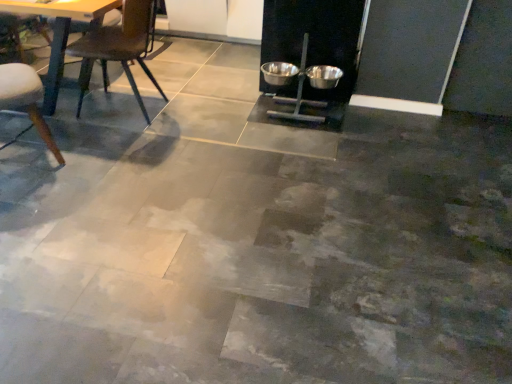
Where is `metallic silver bowl at center-right, the 2th bowl viewed from the left`? The height and width of the screenshot is (384, 512). metallic silver bowl at center-right, the 2th bowl viewed from the left is located at coordinates (324, 76).

You are a GUI agent. You are given a task and a screenshot of the screen. Output one action in this format:
    pyautogui.click(x=<x>, y=<y>)
    Task: Click on the wooden chair at left, the second chair when ordered from right to left
    
    Given the screenshot: What is the action you would take?
    pyautogui.click(x=26, y=99)

This screenshot has height=384, width=512. Describe the element at coordinates (279, 73) in the screenshot. I see `metallic bowls at center, the second bowl in the right-to-left sequence` at that location.

I want to click on metallic dark brown chair at left, the first chair positioned from the right, so click(119, 48).

Is metallic dark brown chair at left, the first chair positioned from the right, oriented towards wooden chair at left, the first chair positioned from the left?

No.

Is there a large distance between metallic dark brown chair at left, positioned as the 2th chair in left-to-right order, and wooden chair at left, the first chair positioned from the left?

No, metallic dark brown chair at left, positioned as the 2th chair in left-to-right order, is not far away from wooden chair at left, the first chair positioned from the left.

Which object is closer to the camera, metallic dark brown chair at left, the first chair positioned from the right, or wooden chair at left, the second chair when ordered from right to left?

wooden chair at left, the second chair when ordered from right to left.

Is metallic bowls at center, the second bowl in the right-to-left sequence, inside the boundaries of wooden chair at left, the second chair when ordered from right to left, or outside?

metallic bowls at center, the second bowl in the right-to-left sequence, is not inside wooden chair at left, the second chair when ordered from right to left, it's outside.

Is metallic bowls at center, the second bowl in the right-to-left sequence, bigger or smaller than wooden chair at left, the second chair when ordered from right to left?

In the image, metallic bowls at center, the second bowl in the right-to-left sequence, appears to be smaller than wooden chair at left, the second chair when ordered from right to left.

Considering the relative positions of metallic bowls at center, placed as the first bowl when sorted from left to right, and wooden chair at left, the second chair when ordered from right to left, in the image provided, is metallic bowls at center, placed as the first bowl when sorted from left to right, behind wooden chair at left, the second chair when ordered from right to left,?

Yes, the depth of metallic bowls at center, placed as the first bowl when sorted from left to right, is greater than that of wooden chair at left, the second chair when ordered from right to left.

The width and height of the screenshot is (512, 384). What are the coordinates of `the 2nd bowl behind when counting from the wooden chair at left, the first chair positioned from the left` in the screenshot? It's located at (279, 73).

Based on the photo, from the image's perspective, is wooden chair at left, the second chair when ordered from right to left, located above or below metallic dark brown chair at left, positioned as the 2th chair in left-to-right order?

Based on their image positions, wooden chair at left, the second chair when ordered from right to left, is located beneath metallic dark brown chair at left, positioned as the 2th chair in left-to-right order.

Is wooden chair at left, the second chair when ordered from right to left, wider than metallic dark brown chair at left, positioned as the 2th chair in left-to-right order?

Incorrect, the width of wooden chair at left, the second chair when ordered from right to left, does not surpass that of metallic dark brown chair at left, positioned as the 2th chair in left-to-right order.

Is metallic dark brown chair at left, positioned as the 2th chair in left-to-right order, at the back of wooden chair at left, the second chair when ordered from right to left?

wooden chair at left, the second chair when ordered from right to left, is not turned away from metallic dark brown chair at left, positioned as the 2th chair in left-to-right order.

In terms of size, does wooden chair at left, the second chair when ordered from right to left, appear bigger or smaller than metallic dark brown chair at left, positioned as the 2th chair in left-to-right order?

Considering their sizes, wooden chair at left, the second chair when ordered from right to left, takes up less space than metallic dark brown chair at left, positioned as the 2th chair in left-to-right order.

Would you say wooden chair at left, the second chair when ordered from right to left, contains metallic silver bowl at center-right, the 1th bowl from the right?

A: Definitely not — metallic silver bowl at center-right, the 1th bowl from the right, is not inside wooden chair at left, the second chair when ordered from right to left.

Are wooden chair at left, the second chair when ordered from right to left, and metallic silver bowl at center-right, the 2th bowl viewed from the left, located far from each other?

Yes.

Does wooden chair at left, the second chair when ordered from right to left, have a larger size compared to metallic silver bowl at center-right, the 1th bowl from the right?

Yes, wooden chair at left, the second chair when ordered from right to left, is bigger than metallic silver bowl at center-right, the 1th bowl from the right.

How many degrees apart are the facing directions of wooden chair at left, the second chair when ordered from right to left, and metallic silver bowl at center-right, the 1th bowl from the right?

135 degrees.

Could you tell me if metallic bowls at center, the second bowl in the right-to-left sequence, is turned towards metallic silver bowl at center-right, the 2th bowl viewed from the left?

No, metallic bowls at center, the second bowl in the right-to-left sequence, is not facing towards metallic silver bowl at center-right, the 2th bowl viewed from the left.

Where is `bowl behind the metallic silver bowl at center-right, the 2th bowl viewed from the left`? bowl behind the metallic silver bowl at center-right, the 2th bowl viewed from the left is located at coordinates (279, 73).

Is metallic bowls at center, placed as the first bowl when sorted from left to right, closer to camera compared to metallic silver bowl at center-right, the 1th bowl from the right?

That is False.

What's the angular difference between metallic bowls at center, the second bowl in the right-to-left sequence, and metallic silver bowl at center-right, the 1th bowl from the right,'s facing directions?

0.000851 degrees separate the facing orientations of metallic bowls at center, the second bowl in the right-to-left sequence, and metallic silver bowl at center-right, the 1th bowl from the right.

From the image's perspective, is metallic silver bowl at center-right, the 2th bowl viewed from the left, on top of metallic bowls at center, placed as the first bowl when sorted from left to right?

No, from the image's perspective, metallic silver bowl at center-right, the 2th bowl viewed from the left, is not above metallic bowls at center, placed as the first bowl when sorted from left to right.

Which of these two, metallic silver bowl at center-right, the 2th bowl viewed from the left, or metallic bowls at center, the second bowl in the right-to-left sequence, is thinner?

Thinner between the two is metallic silver bowl at center-right, the 2th bowl viewed from the left.

Considering the relative positions of metallic silver bowl at center-right, the 2th bowl viewed from the left, and metallic bowls at center, the second bowl in the right-to-left sequence, in the image provided, is metallic silver bowl at center-right, the 2th bowl viewed from the left, to the right of metallic bowls at center, the second bowl in the right-to-left sequence, from the viewer's perspective?

Yes.

Is metallic silver bowl at center-right, the 1th bowl from the right, in front of or behind metallic bowls at center, placed as the first bowl when sorted from left to right, in the image?

Clearly, metallic silver bowl at center-right, the 1th bowl from the right, is in front of metallic bowls at center, placed as the first bowl when sorted from left to right.

Which of these two, metallic silver bowl at center-right, the 1th bowl from the right, or metallic dark brown chair at left, the first chair positioned from the right, is smaller?

metallic silver bowl at center-right, the 1th bowl from the right.

Between metallic silver bowl at center-right, the 2th bowl viewed from the left, and metallic dark brown chair at left, positioned as the 2th chair in left-to-right order, which one appears on the left side from the viewer's perspective?

metallic dark brown chair at left, positioned as the 2th chair in left-to-right order.

Is metallic silver bowl at center-right, the 1th bowl from the right, in front of metallic dark brown chair at left, positioned as the 2th chair in left-to-right order?

No, metallic silver bowl at center-right, the 1th bowl from the right, is further to the viewer.

Based on the photo, would you say metallic silver bowl at center-right, the 2th bowl viewed from the left, is a long distance from metallic dark brown chair at left, positioned as the 2th chair in left-to-right order?

metallic silver bowl at center-right, the 2th bowl viewed from the left, is positioned a significant distance from metallic dark brown chair at left, positioned as the 2th chair in left-to-right order.

Image resolution: width=512 pixels, height=384 pixels. I want to click on chair behind the wooden chair at left, the second chair when ordered from right to left, so click(x=119, y=48).

Where is `the 1st bowl to the right of the wooden chair at left, the first chair positioned from the left, counting from the anchor's position`? Image resolution: width=512 pixels, height=384 pixels. the 1st bowl to the right of the wooden chair at left, the first chair positioned from the left, counting from the anchor's position is located at coordinates (279, 73).

Consider the image. Estimate the real-world distances between objects in this image. Which object is further from metallic silver bowl at center-right, the 2th bowl viewed from the left, metallic dark brown chair at left, positioned as the 2th chair in left-to-right order, or metallic bowls at center, placed as the first bowl when sorted from left to right?

metallic dark brown chair at left, positioned as the 2th chair in left-to-right order.

Looking at the image, which one is located further to metallic dark brown chair at left, positioned as the 2th chair in left-to-right order, metallic silver bowl at center-right, the 2th bowl viewed from the left, or metallic bowls at center, placed as the first bowl when sorted from left to right?

metallic silver bowl at center-right, the 2th bowl viewed from the left, is further to metallic dark brown chair at left, positioned as the 2th chair in left-to-right order.

Looking at the image, which one is located closer to wooden chair at left, the first chair positioned from the left, metallic dark brown chair at left, the first chair positioned from the right, or metallic silver bowl at center-right, the 1th bowl from the right?

metallic dark brown chair at left, the first chair positioned from the right, lies closer to wooden chair at left, the first chair positioned from the left, than the other object.

From the picture: Estimate the real-world distances between objects in this image. Which object is closer to metallic silver bowl at center-right, the 2th bowl viewed from the left, wooden chair at left, the first chair positioned from the left, or metallic dark brown chair at left, the first chair positioned from the right?

metallic dark brown chair at left, the first chair positioned from the right, is closer to metallic silver bowl at center-right, the 2th bowl viewed from the left.

Based on the photo, based on their spatial positions, is wooden chair at left, the first chair positioned from the left, or metallic silver bowl at center-right, the 2th bowl viewed from the left, further from metallic bowls at center, placed as the first bowl when sorted from left to right?

wooden chair at left, the first chair positioned from the left, lies further to metallic bowls at center, placed as the first bowl when sorted from left to right, than the other object.

Which object lies nearer to the anchor point metallic silver bowl at center-right, the 2th bowl viewed from the left, metallic bowls at center, placed as the first bowl when sorted from left to right, or wooden chair at left, the second chair when ordered from right to left?

Among the two, metallic bowls at center, placed as the first bowl when sorted from left to right, is located nearer to metallic silver bowl at center-right, the 2th bowl viewed from the left.

Looking at the image, which one is located further to metallic dark brown chair at left, the first chair positioned from the right, wooden chair at left, the second chair when ordered from right to left, or metallic bowls at center, placed as the first bowl when sorted from left to right?

The object further to metallic dark brown chair at left, the first chair positioned from the right, is metallic bowls at center, placed as the first bowl when sorted from left to right.

From the image, which object appears to be farther from wooden chair at left, the first chair positioned from the left, metallic silver bowl at center-right, the 2th bowl viewed from the left, or metallic dark brown chair at left, the first chair positioned from the right?

metallic silver bowl at center-right, the 2th bowl viewed from the left.

Where is `bowl between wooden chair at left, the first chair positioned from the left, and metallic silver bowl at center-right, the 1th bowl from the right, from left to right`? The height and width of the screenshot is (384, 512). bowl between wooden chair at left, the first chair positioned from the left, and metallic silver bowl at center-right, the 1th bowl from the right, from left to right is located at coordinates (279, 73).

This screenshot has width=512, height=384. I want to click on chair situated between wooden chair at left, the first chair positioned from the left, and metallic silver bowl at center-right, the 2th bowl viewed from the left, from left to right, so click(x=119, y=48).

Identify the location of bowl located between metallic dark brown chair at left, the first chair positioned from the right, and metallic silver bowl at center-right, the 1th bowl from the right, in the left-right direction. (279, 73).

The image size is (512, 384). I want to click on chair between wooden chair at left, the first chair positioned from the left, and metallic bowls at center, placed as the first bowl when sorted from left to right, from left to right, so click(x=119, y=48).